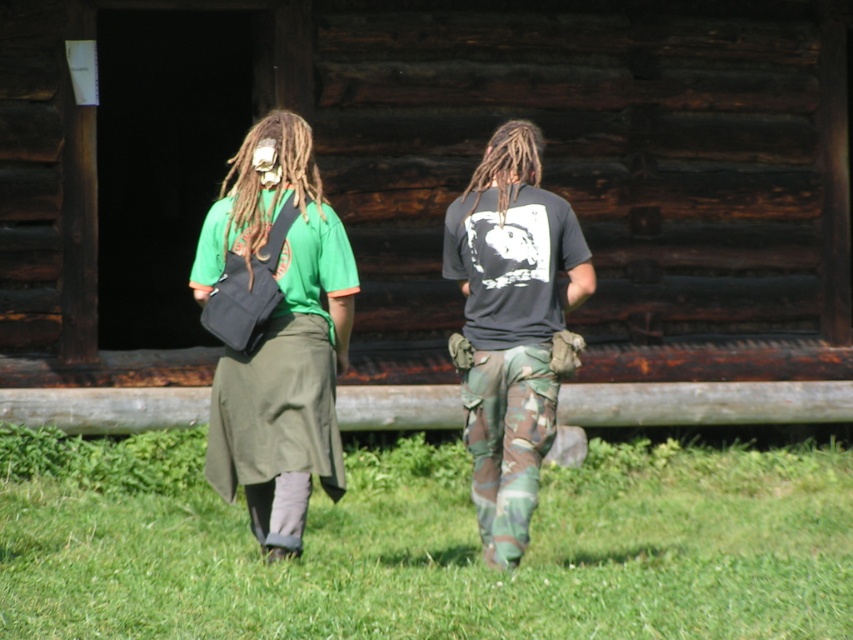
Question: Does green grass at lower center have a smaller size compared to green matte shirt at center?

Choices:
 (A) yes
 (B) no

Answer: (A)

Question: Which object is farther from the camera taking this photo?

Choices:
 (A) green matte shirt at center
 (B) dreadlocks at center

Answer: (B)

Question: Which object is positioned closest to the green fabric skirt at center?

Choices:
 (A) brown/dry/dreadlocks at center
 (B) dreadlocks at center
 (C) dark gray matte t-shirt at center
 (D) green grass at lower center

Answer: (A)

Question: Is green matte shirt at center positioned behind brown/dry/dreadlocks at center?

Choices:
 (A) yes
 (B) no

Answer: (B)

Question: Among these objects, which one is farthest from the camera?

Choices:
 (A) green matte shirt at center
 (B) brown/dry/dreadlocks at center
 (C) green fabric skirt at center

Answer: (B)

Question: Does green fabric skirt at center appear over green matte shirt at center?

Choices:
 (A) yes
 (B) no

Answer: (A)